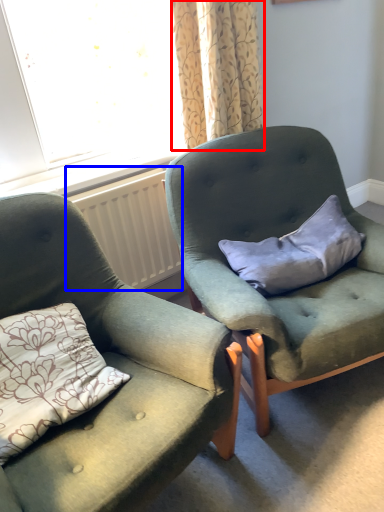
Question: Which of the following is the closest to the observer, curtain (highlighted by a red box) or radiator (highlighted by a blue box)?

Choices:
 (A) curtain
 (B) radiator

Answer: (A)